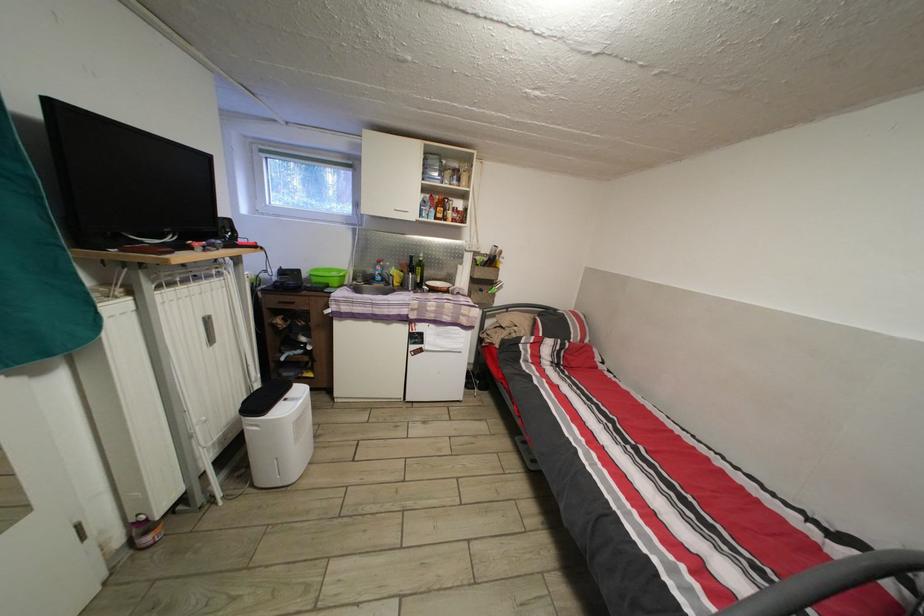
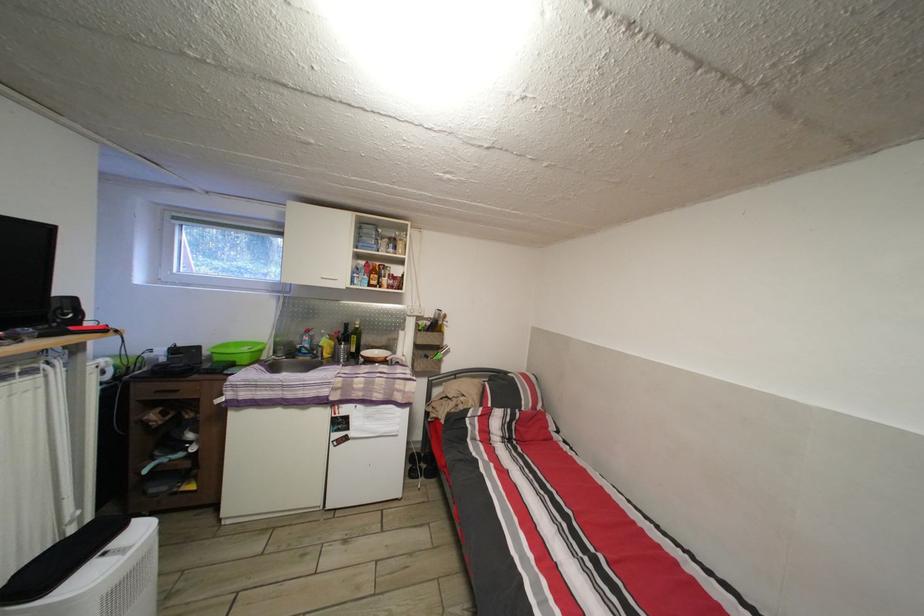
Locate, in the second image, the point that corresponds to the point at 426,276 in the first image.

(360, 345)